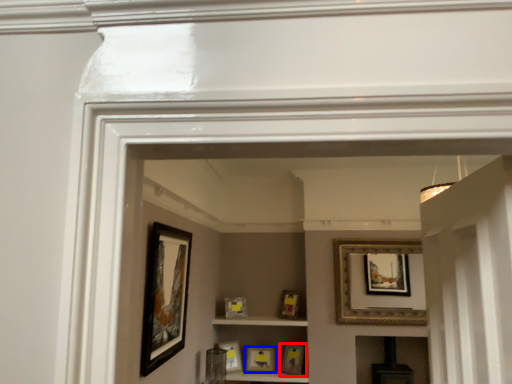
Question: Among these objects, which one is farthest to the camera, picture frame (highlighted by a red box) or picture frame (highlighted by a blue box)?

Choices:
 (A) picture frame
 (B) picture frame

Answer: (B)